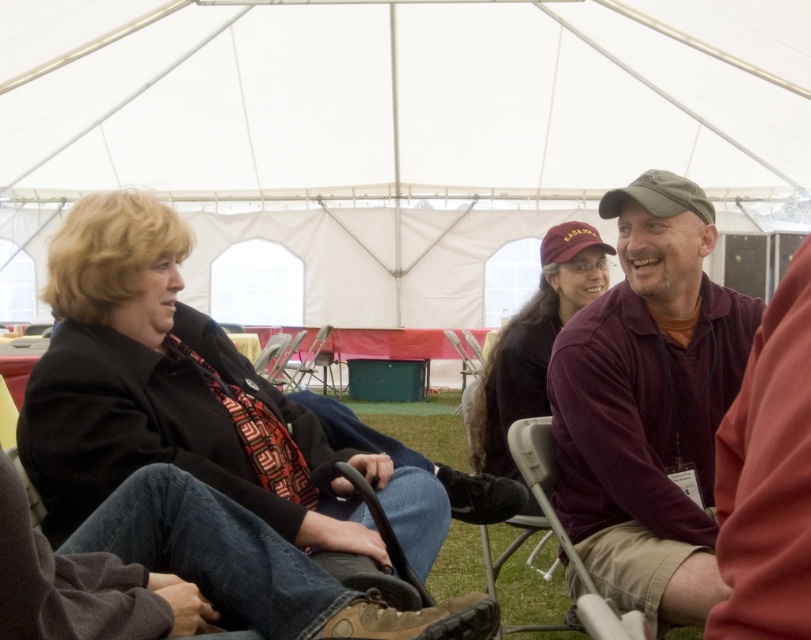
Can you confirm if matte black jacket at center is positioned to the left of maroon jersey at center?

Indeed, matte black jacket at center is positioned on the left side of maroon jersey at center.

Is matte black jacket at center behind maroon jersey at center?

Yes, it is behind maroon jersey at center.

What do you see at coordinates (187, 400) in the screenshot? I see `matte black jacket at center` at bounding box center [187, 400].

The image size is (811, 640). In order to click on matte black jacket at center in this screenshot , I will do `click(187, 400)`.